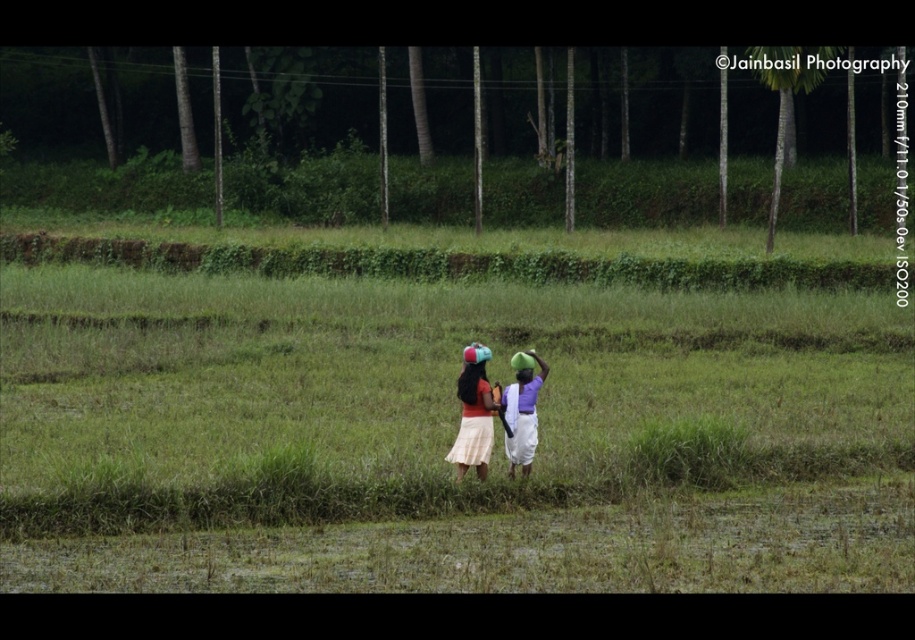
In the scene shown: Can you confirm if matte fabric dress at center is taller than matte green headscarf at center?

Yes, matte fabric dress at center is taller than matte green headscarf at center.

Is matte fabric dress at center further to camera compared to matte green headscarf at center?

No.

Does point (520, 396) come closer to viewer compared to point (524, 449)?

No, (520, 396) is behind (524, 449).

Locate an element on the screen. The image size is (915, 640). matte fabric dress at center is located at coordinates (496, 412).

From the picture: Between matte fabric dress at center and green matte headband at center, which one appears on the left side from the viewer's perspective?

From the viewer's perspective, matte fabric dress at center appears more on the left side.

Between point (467, 432) and point (521, 353), which one is positioned behind?

Point (521, 353)

Where is `matte fabric dress at center`? This screenshot has height=640, width=915. matte fabric dress at center is located at coordinates (496, 412).

Who is lower down, matte green headscarf at center or green matte headband at center?

Positioned lower is matte green headscarf at center.

Can you confirm if matte green headscarf at center is shorter than green matte headband at center?

In fact, matte green headscarf at center may be taller than green matte headband at center.

This screenshot has height=640, width=915. Identify the location of matte green headscarf at center. (522, 413).